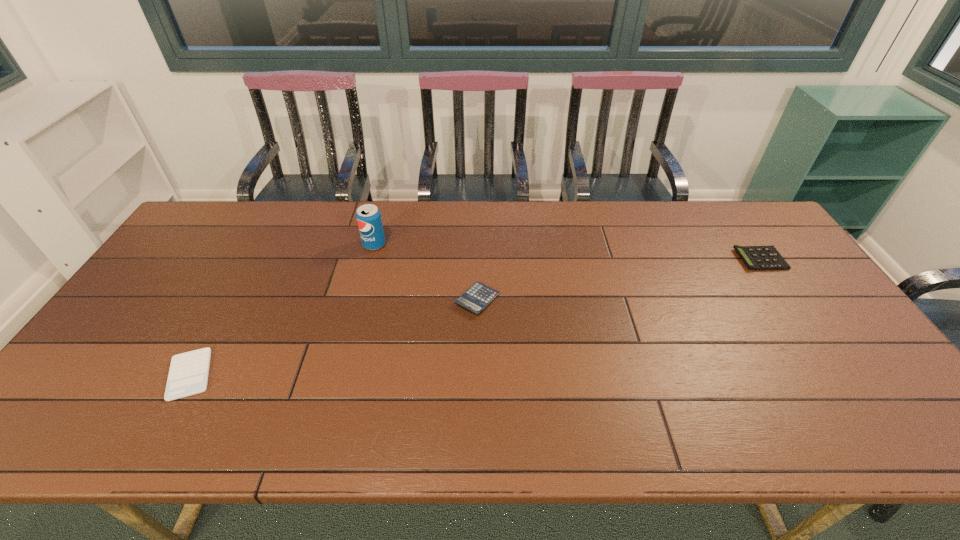
What are the coordinates of `empty location between the third farthest object and the leftmost calculator` in the screenshot? It's located at (333, 337).

The width and height of the screenshot is (960, 540). Find the location of `free space between the soda can and the third farthest object`. free space between the soda can and the third farthest object is located at coordinates (x=426, y=272).

Identify the location of vacant space in between the second nearest calculator and the third object from right to left. This screenshot has height=540, width=960. (426, 272).

Locate an element on the screen. free space between the third farthest object and the third object from right to left is located at coordinates (426, 272).

The width and height of the screenshot is (960, 540). I want to click on blank region between the tallest object and the leftmost calculator, so click(282, 309).

The image size is (960, 540). In order to click on free spot between the farthest calculator and the second object from right to left in this screenshot , I will do `click(618, 279)`.

At what (x,y) coordinates should I click in order to perform the action: click on blank region between the shortest calculator and the soda can. Please return your answer as a coordinate pair (x, y). The width and height of the screenshot is (960, 540). Looking at the image, I should click on (282, 309).

The width and height of the screenshot is (960, 540). In order to click on vacant space that is in between the farthest calculator and the leftmost calculator in this screenshot , I will do `click(475, 317)`.

This screenshot has width=960, height=540. I want to click on unoccupied position between the rightmost calculator and the nearest calculator, so click(x=475, y=317).

The image size is (960, 540). Identify the location of object that is the third closest to the nearest object. [759, 258].